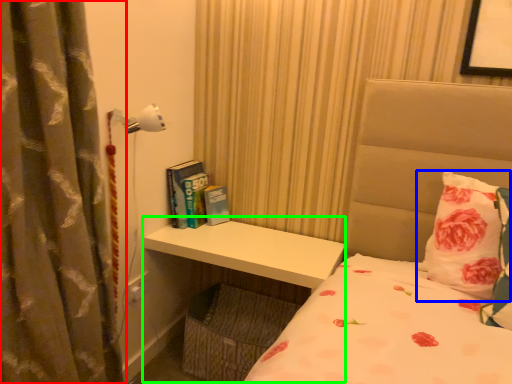
Question: Estimate the real-world distances between objects in this image. Which object is farther from curtain (highlighted by a red box), pillow (highlighted by a blue box) or table (highlighted by a green box)?

Choices:
 (A) pillow
 (B) table

Answer: (A)